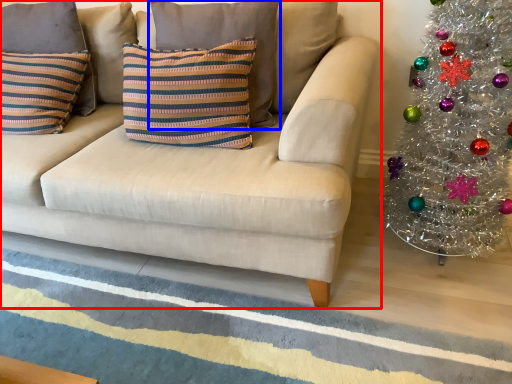
Question: Which of the following is the farthest to the observer, studio couch (highlighted by a red box) or pillow (highlighted by a blue box)?

Choices:
 (A) studio couch
 (B) pillow

Answer: (B)